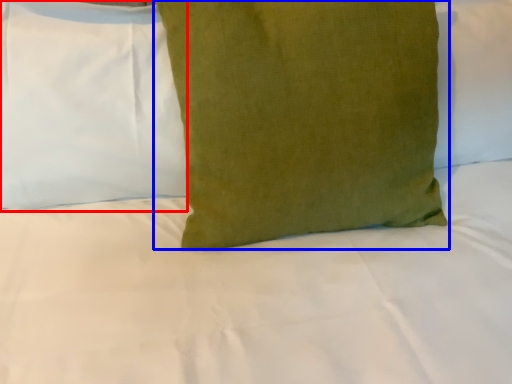
Question: Which object is further to the camera taking this photo, pillow (highlighted by a red box) or pillow (highlighted by a blue box)?

Choices:
 (A) pillow
 (B) pillow

Answer: (A)